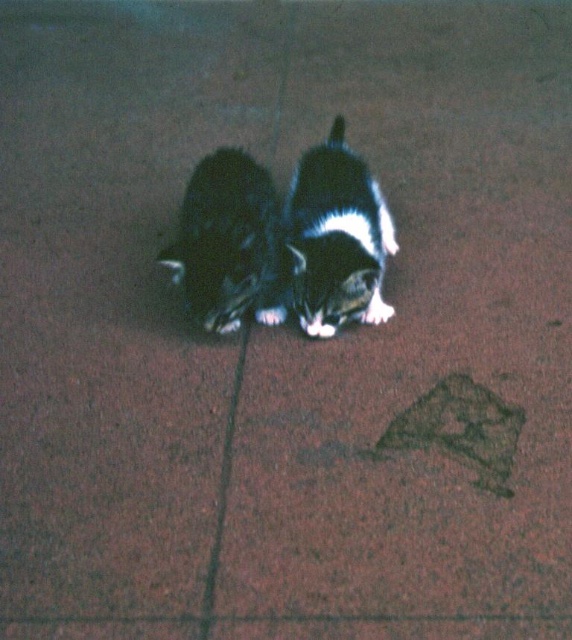
Question: Does black and white fur cat at center have a greater width compared to black fur cat at center?

Choices:
 (A) yes
 (B) no

Answer: (A)

Question: Observing the image, what is the correct spatial positioning of black and white fur cat at center in reference to black fur cat at center?

Choices:
 (A) above
 (B) below

Answer: (B)

Question: Which of the following is the farthest from the observer?

Choices:
 (A) (355, 173)
 (B) (227, 147)

Answer: (B)

Question: Does black and white fur cat at center appear under black fur cat at center?

Choices:
 (A) yes
 (B) no

Answer: (A)

Question: Which point is closer to the camera?

Choices:
 (A) black and white fur cat at center
 (B) black fur cat at center

Answer: (B)